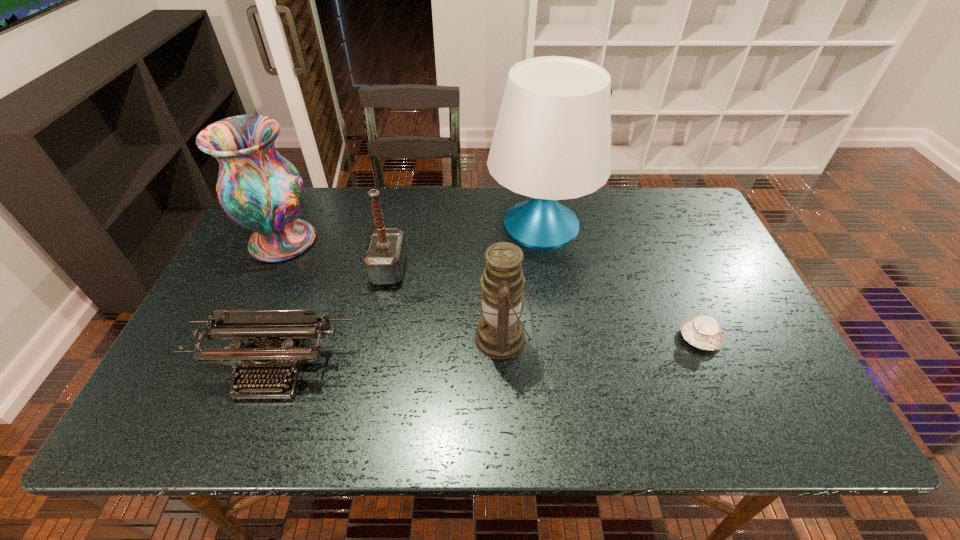
Find the location of a particular element. the tallest object is located at coordinates (552, 141).

At what (x,y) coordinates should I click in order to perform the action: click on the second tallest object. Please return your answer as a coordinate pair (x, y). Looking at the image, I should click on (260, 190).

Find the location of a particular element. The height and width of the screenshot is (540, 960). oil lamp is located at coordinates (500, 334).

The image size is (960, 540). I want to click on hammer, so click(x=385, y=255).

The image size is (960, 540). In order to click on typewriter in this screenshot , I will do `click(271, 348)`.

The width and height of the screenshot is (960, 540). What are the coordinates of `teacup` in the screenshot? It's located at (703, 332).

Find the location of `the rightmost object`. the rightmost object is located at coordinates (703, 332).

At what (x,y) coordinates should I click in order to perform the action: click on vacant space located on the front-facing side of the table lamp. Please return your answer as a coordinate pair (x, y). This screenshot has width=960, height=540. Looking at the image, I should click on (383, 224).

This screenshot has width=960, height=540. I want to click on free space located on the front-facing side of the table lamp, so click(470, 224).

Where is `vacant region located 0.090m on the front-facing side of the table lamp`? This screenshot has width=960, height=540. vacant region located 0.090m on the front-facing side of the table lamp is located at coordinates (457, 224).